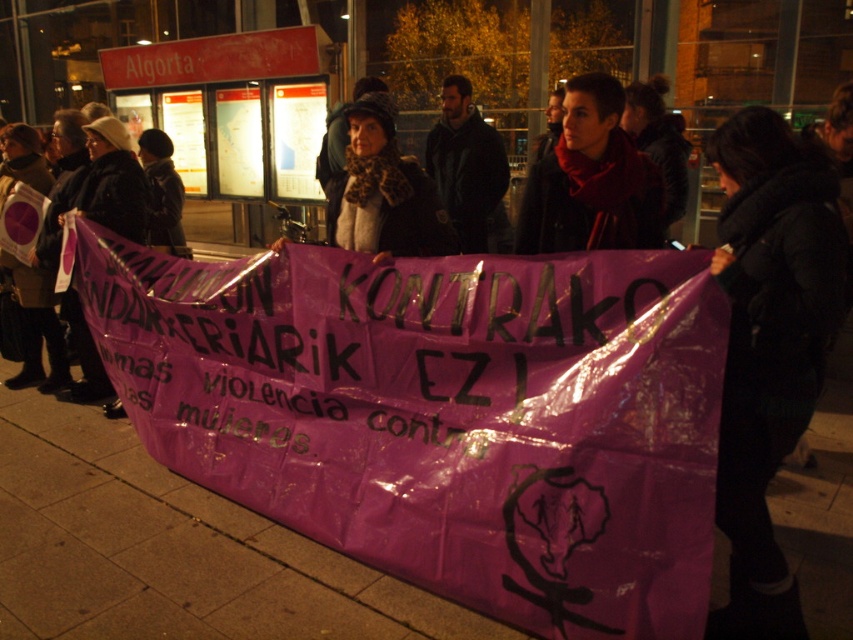
Question: Which of the following is the closest to the observer?

Choices:
 (A) black fuzzy jacket at center
 (B) dark blue jacket at center
 (C) black woolen hat at upper left

Answer: (A)

Question: Which of these objects is positioned farthest from the black fuzzy jacket at center?

Choices:
 (A) matte red scarf at center
 (B) dark blue jacket at center
 (C) black woolen hat at upper left

Answer: (C)

Question: Is black fuzzy jacket at center below black woolen hat at upper left?

Choices:
 (A) no
 (B) yes

Answer: (B)

Question: Which of the following is the farthest from the observer?

Choices:
 (A) black fuzzy jacket at center
 (B) matte red scarf at center
 (C) black woolen hat at upper left

Answer: (C)

Question: Is dark blue jacket at center positioned before black woolen hat at upper left?

Choices:
 (A) no
 (B) yes

Answer: (A)

Question: Does black fuzzy jacket at center appear on the left side of matte red scarf at center?

Choices:
 (A) no
 (B) yes

Answer: (A)